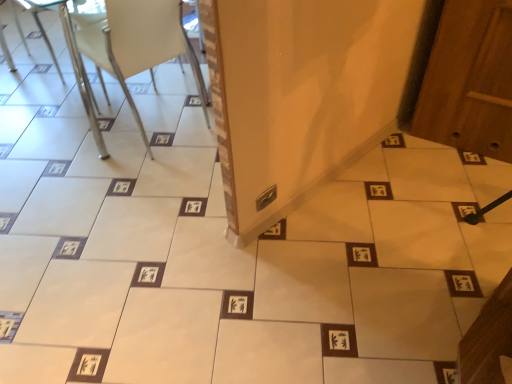
Question: From the image's perspective, is white plastic chair at upper left below metallic silver chair at upper left?

Choices:
 (A) no
 (B) yes

Answer: (B)

Question: Is white plastic chair at upper left aimed at metallic silver chair at upper left?

Choices:
 (A) yes
 (B) no

Answer: (B)

Question: Does white plastic chair at upper left have a lesser height compared to metallic silver chair at upper left?

Choices:
 (A) no
 (B) yes

Answer: (A)

Question: Considering the relative sizes of white plastic chair at upper left and metallic silver chair at upper left in the image provided, is white plastic chair at upper left bigger than metallic silver chair at upper left?

Choices:
 (A) yes
 (B) no

Answer: (A)

Question: From the image's perspective, is white plastic chair at upper left on metallic silver chair at upper left?

Choices:
 (A) no
 (B) yes

Answer: (A)

Question: Considering the relative positions of white plastic chair at upper left and metallic silver chair at upper left in the image provided, is white plastic chair at upper left to the left of metallic silver chair at upper left from the viewer's perspective?

Choices:
 (A) yes
 (B) no

Answer: (B)

Question: Is metallic silver chair at upper left to the left of white plastic chair at upper left from the viewer's perspective?

Choices:
 (A) no
 (B) yes

Answer: (B)

Question: Is metallic silver chair at upper left not near white plastic chair at upper left?

Choices:
 (A) yes
 (B) no

Answer: (B)

Question: Does metallic silver chair at upper left have a greater height compared to white plastic chair at upper left?

Choices:
 (A) yes
 (B) no

Answer: (B)

Question: Considering the relative sizes of metallic silver chair at upper left and white plastic chair at upper left in the image provided, is metallic silver chair at upper left bigger than white plastic chair at upper left?

Choices:
 (A) no
 (B) yes

Answer: (A)

Question: Does metallic silver chair at upper left lie in front of white plastic chair at upper left?

Choices:
 (A) yes
 (B) no

Answer: (B)

Question: Could you tell me if metallic silver chair at upper left is facing white plastic chair at upper left?

Choices:
 (A) yes
 (B) no

Answer: (A)

Question: From the image's perspective, is white plastic chair at upper left positioned above or below metallic silver chair at upper left?

Choices:
 (A) above
 (B) below

Answer: (B)